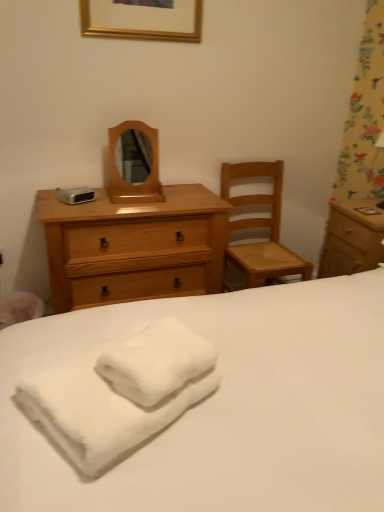
Question: Is the depth of light brown wooden chest of drawers at center-left greater than that of wooden mirror at center?

Choices:
 (A) yes
 (B) no

Answer: (B)

Question: From the image's perspective, is light brown wooden chest of drawers at center-left under wooden mirror at center?

Choices:
 (A) yes
 (B) no

Answer: (A)

Question: Can you confirm if light brown wooden chest of drawers at center-left is bigger than wooden mirror at center?

Choices:
 (A) no
 (B) yes

Answer: (B)

Question: From the image's perspective, is light brown wooden chest of drawers at center-left above wooden mirror at center?

Choices:
 (A) yes
 (B) no

Answer: (B)

Question: Can you confirm if light brown wooden chest of drawers at center-left is shorter than wooden mirror at center?

Choices:
 (A) yes
 (B) no

Answer: (B)

Question: From a real-world perspective, is white fluffy bath towel at lower left positioned above or below wooden nightstand at right?

Choices:
 (A) below
 (B) above

Answer: (B)

Question: Considering their positions, is white fluffy bath towel at lower left located in front of or behind wooden nightstand at right?

Choices:
 (A) behind
 (B) front

Answer: (B)

Question: Do you think white fluffy bath towel at lower left is within wooden nightstand at right, or outside of it?

Choices:
 (A) outside
 (B) inside

Answer: (A)

Question: From the image's perspective, is white fluffy bath towel at lower left positioned above or below wooden nightstand at right?

Choices:
 (A) above
 (B) below

Answer: (B)

Question: Choose the correct answer: Is light brown wooden chest of drawers at center-left inside wooden nightstand at right or outside it?

Choices:
 (A) outside
 (B) inside

Answer: (A)

Question: Considering the relative positions of light brown wooden chest of drawers at center-left and wooden nightstand at right in the image provided, is light brown wooden chest of drawers at center-left to the left or to the right of wooden nightstand at right?

Choices:
 (A) left
 (B) right

Answer: (A)

Question: Considering the positions of light brown wooden chest of drawers at center-left and wooden nightstand at right in the image, is light brown wooden chest of drawers at center-left bigger or smaller than wooden nightstand at right?

Choices:
 (A) small
 (B) big

Answer: (B)

Question: In terms of height, does light brown wooden chest of drawers at center-left look taller or shorter compared to wooden nightstand at right?

Choices:
 (A) short
 (B) tall

Answer: (B)

Question: Which is correct: light brown wooden chest of drawers at center-left is inside gold wooden picture frame at upper center, or outside of it?

Choices:
 (A) outside
 (B) inside

Answer: (A)

Question: Considering the positions of light brown wooden chest of drawers at center-left and gold wooden picture frame at upper center in the image, is light brown wooden chest of drawers at center-left wider or thinner than gold wooden picture frame at upper center?

Choices:
 (A) thin
 (B) wide

Answer: (B)